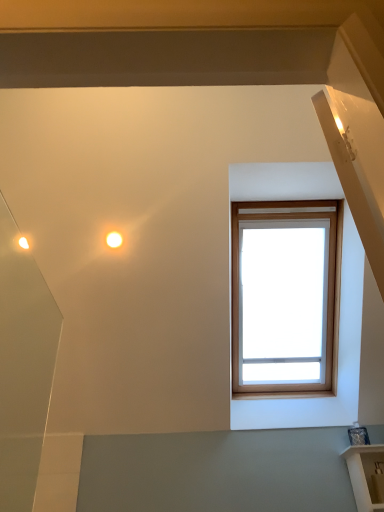
What do you see at coordinates (364, 474) in the screenshot?
I see `white glossy shelf at lower right` at bounding box center [364, 474].

Identify the location of white glossy shelf at lower right. Image resolution: width=384 pixels, height=512 pixels. (364, 474).

Measure the distance between point [117,242] and camera.

A distance of 6.64 feet exists between point [117,242] and camera.

What is the approximate height of matte white droplight at upper left?

The height of matte white droplight at upper left is 3.68 inches.

The width and height of the screenshot is (384, 512). What do you see at coordinates (114, 239) in the screenshot?
I see `matte white droplight at upper left` at bounding box center [114, 239].

At what (x,y) coordinates should I click in order to perform the action: click on matte white droplight at upper left. Please return your answer as a coordinate pair (x, y). Looking at the image, I should click on (114, 239).

At what (x,y) coordinates should I click in order to perform the action: click on white glossy shelf at lower right. Please return your answer as a coordinate pair (x, y). Image resolution: width=384 pixels, height=512 pixels. Looking at the image, I should click on (364, 474).

Between white glossy shelf at lower right and matte white droplight at upper left, which one appears on the right side from the viewer's perspective?

white glossy shelf at lower right is more to the right.

Is the position of white glossy shelf at lower right more distant than that of matte white droplight at upper left?

No, white glossy shelf at lower right is closer to the camera.

Considering the positions of point (347, 453) and point (117, 231), is point (347, 453) closer or farther from the camera than point (117, 231)?

Point (347, 453) is positioned farther from the camera compared to point (117, 231).

From the image's perspective, is white glossy shelf at lower right above matte white droplight at upper left?

Incorrect, from the image's perspective, white glossy shelf at lower right is lower than matte white droplight at upper left.

From a real-world perspective, is white glossy shelf at lower right below matte white droplight at upper left?

Yes.

Considering the sizes of objects white glossy shelf at lower right and matte white droplight at upper left in the image provided, who is thinner, white glossy shelf at lower right or matte white droplight at upper left?

matte white droplight at upper left is thinner.

Considering the sizes of white glossy shelf at lower right and matte white droplight at upper left in the image, is white glossy shelf at lower right taller or shorter than matte white droplight at upper left?

In the image, white glossy shelf at lower right appears to be taller than matte white droplight at upper left.

Is white glossy shelf at lower right bigger than matte white droplight at upper left?

Correct, white glossy shelf at lower right is larger in size than matte white droplight at upper left.

From the picture: Which is correct: white glossy shelf at lower right is inside matte white droplight at upper left, or outside of it?

The correct answer is: outside.

Is white glossy shelf at lower right in contact with matte white droplight at upper left?

No, white glossy shelf at lower right is not touching matte white droplight at upper left.

Is white glossy shelf at lower right facing away from matte white droplight at upper left?

white glossy shelf at lower right is not turned away from matte white droplight at upper left.

Image resolution: width=384 pixels, height=512 pixels. In order to click on shelf to the right of matte white droplight at upper left in this screenshot , I will do `click(364, 474)`.

Is matte white droplight at upper left to the left of white glossy shelf at lower right from the viewer's perspective?

Correct, you'll find matte white droplight at upper left to the left of white glossy shelf at lower right.

Does matte white droplight at upper left lie in front of white glossy shelf at lower right?

No, matte white droplight at upper left is further to the viewer.

Which is more distant, [113,242] or [352,454]?

Positioned behind is point [352,454].

From the image's perspective, is matte white droplight at upper left located above or below white glossy shelf at lower right?

matte white droplight at upper left is situated higher than white glossy shelf at lower right in the image.

From a real-world perspective, does matte white droplight at upper left sit lower than white glossy shelf at lower right?

No, from a real-world perspective, matte white droplight at upper left is not below white glossy shelf at lower right.

Considering the relative sizes of matte white droplight at upper left and white glossy shelf at lower right in the image provided, is matte white droplight at upper left wider than white glossy shelf at lower right?

No, matte white droplight at upper left is not wider than white glossy shelf at lower right.

Which of these two, matte white droplight at upper left or white glossy shelf at lower right, stands taller?

white glossy shelf at lower right.

Does matte white droplight at upper left have a smaller size compared to white glossy shelf at lower right?

Correct, matte white droplight at upper left occupies less space than white glossy shelf at lower right.

Would you say matte white droplight at upper left is inside or outside white glossy shelf at lower right?

matte white droplight at upper left is outside white glossy shelf at lower right.

Does matte white droplight at upper left touch white glossy shelf at lower right?

There is a gap between matte white droplight at upper left and white glossy shelf at lower right.

Is matte white droplight at upper left facing towards white glossy shelf at lower right?

No, matte white droplight at upper left is not turned towards white glossy shelf at lower right.

How different are the orientations of matte white droplight at upper left and white glossy shelf at lower right in degrees?

The angle between the facing direction of matte white droplight at upper left and the facing direction of white glossy shelf at lower right is 1.56 degrees.

Measure the distance from matte white droplight at upper left to white glossy shelf at lower right.

matte white droplight at upper left and white glossy shelf at lower right are 1.59 meters apart from each other.

I want to click on shelf to the right of matte white droplight at upper left, so click(364, 474).

Locate an element on the screen. droplight above the white glossy shelf at lower right (from a real-world perspective) is located at coordinates (114, 239).

I want to click on droplight that is on the left side of white glossy shelf at lower right, so click(114, 239).